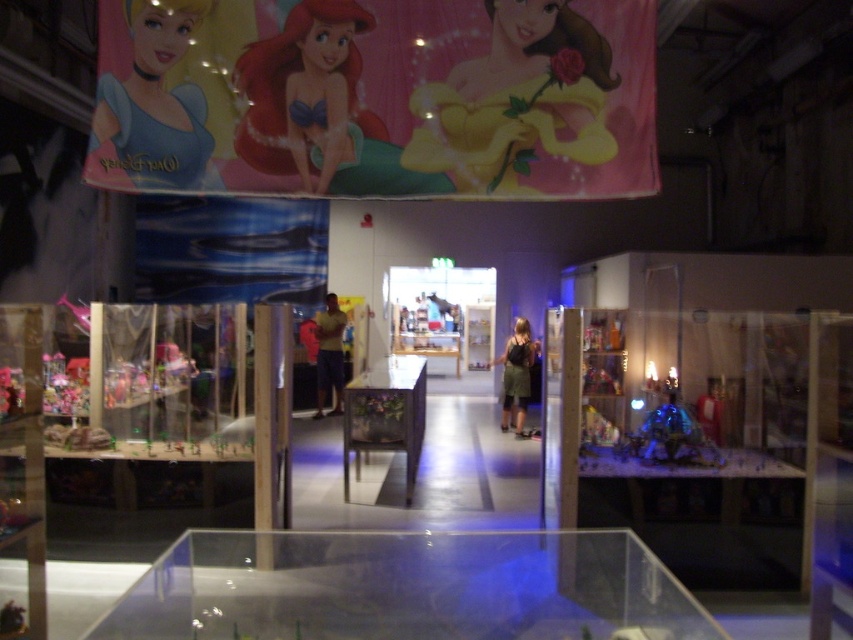
Does transparent glass table at center appear over yellow cotton shirt at center?

Incorrect, transparent glass table at center is not positioned above yellow cotton shirt at center.

The height and width of the screenshot is (640, 853). What are the coordinates of `transparent glass table at center` in the screenshot? It's located at (407, 588).

Who is shorter, matte blue dress at upper left or dark green fabric dress at center?

Standing shorter between the two is matte blue dress at upper left.

Is matte blue dress at upper left further to the viewer compared to dark green fabric dress at center?

No, matte blue dress at upper left is closer to the viewer.

Does point (126, 140) come closer to viewer compared to point (521, 369)?

That is True.

The width and height of the screenshot is (853, 640). In order to click on matte blue dress at upper left in this screenshot , I will do click(x=152, y=106).

Who is more forward, (502, 52) or (335, 387)?

Point (502, 52) is more forward.

Who is taller, pink satin dress at upper center or yellow cotton shirt at center?

yellow cotton shirt at center is taller.

Which is behind, point (563, 28) or point (338, 408)?

The point (338, 408) is more distant.

Locate an element on the screen. pink satin dress at upper center is located at coordinates (517, 99).